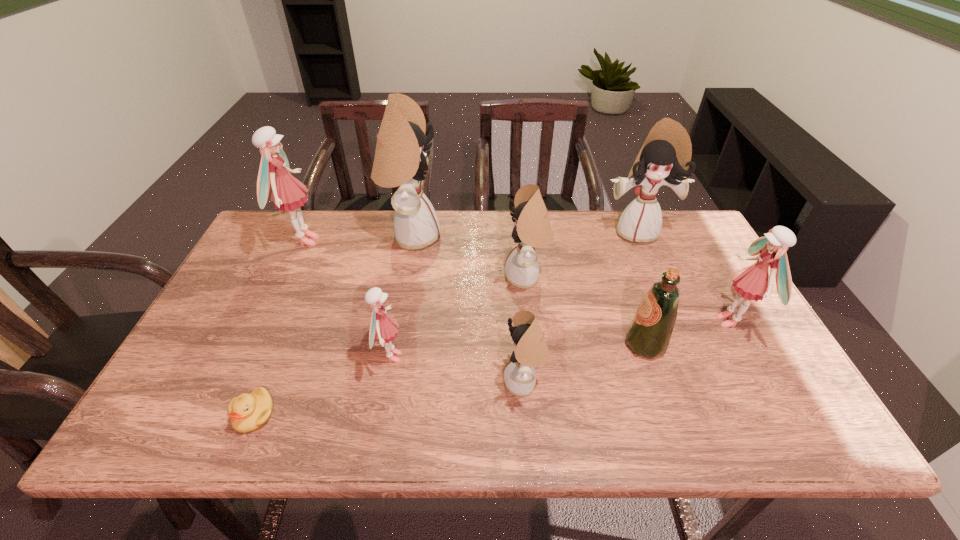
At what (x,y) coordinates should I click in order to perform the action: click on object at the left edge. Please return your answer as a coordinate pair (x, y). The height and width of the screenshot is (540, 960). Looking at the image, I should click on (286, 191).

This screenshot has height=540, width=960. What are the coordinates of `object that is at the far left corner` in the screenshot? It's located at (286, 191).

At what (x,y) coordinates should I click in order to perform the action: click on object located in the far right corner section of the desktop. Please return your answer as a coordinate pair (x, y). Looking at the image, I should click on (665, 156).

At what (x,y) coordinates should I click in order to perform the action: click on vacant space at the far edge of the desktop. Please return your answer as a coordinate pair (x, y). Image resolution: width=960 pixels, height=540 pixels. Looking at the image, I should click on (444, 212).

I want to click on free space at the near edge of the desktop, so click(x=571, y=421).

Where is `free space at the left edge of the desktop`? Image resolution: width=960 pixels, height=540 pixels. free space at the left edge of the desktop is located at coordinates (202, 389).

This screenshot has height=540, width=960. I want to click on free point at the right edge, so click(707, 280).

Identify the location of free region at the far left corner. (276, 233).

I want to click on free space at the near left corner, so click(x=187, y=438).

In the image, there is a desktop. At what (x,y) coordinates should I click in order to perform the action: click on vacant space at the far right corner. Please return your answer as a coordinate pair (x, y). Looking at the image, I should click on (673, 241).